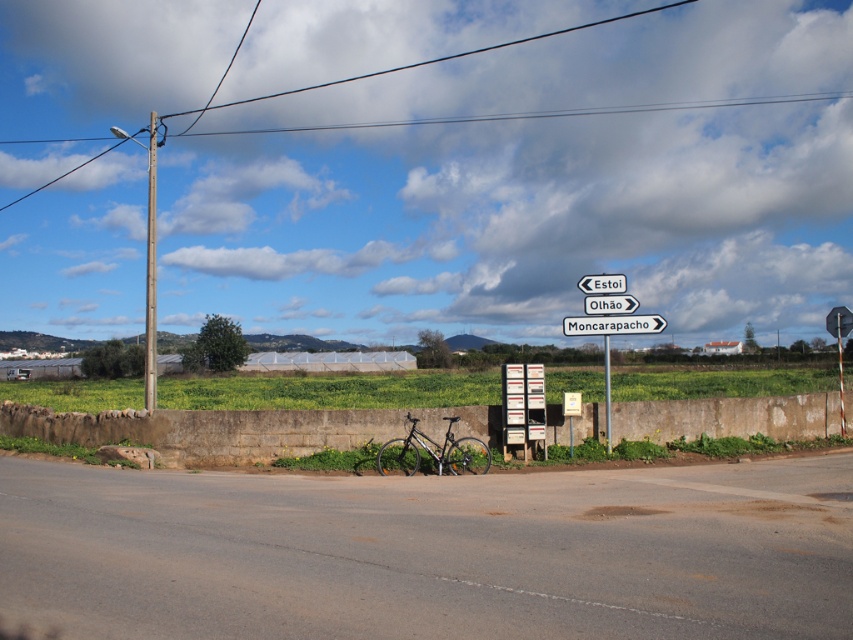
You are a tourist in a rural area and see the white plastic signpost at center and the white plastic sign at upper center. Which one is nearer to you?

The white plastic signpost at center is closer to the viewer than the white plastic sign at upper center.